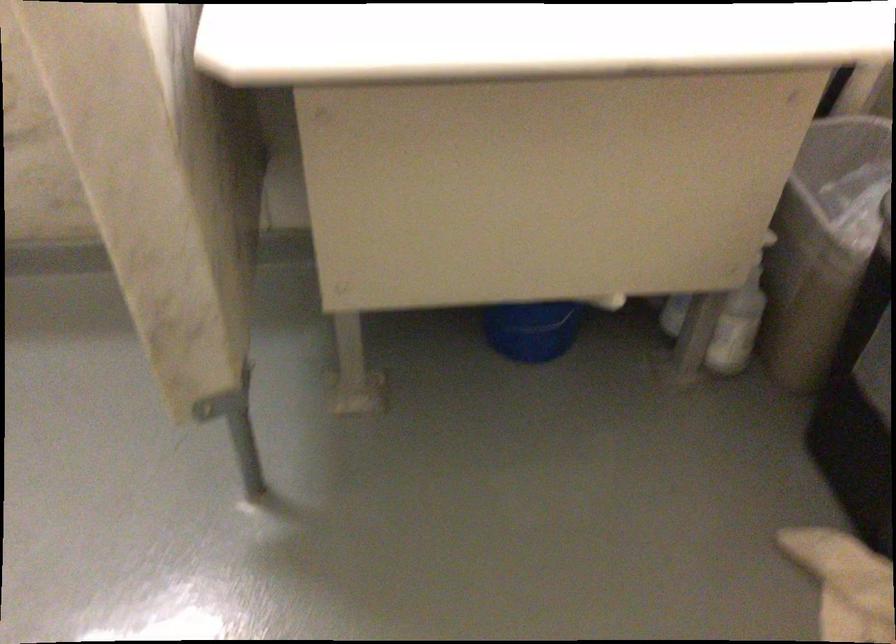
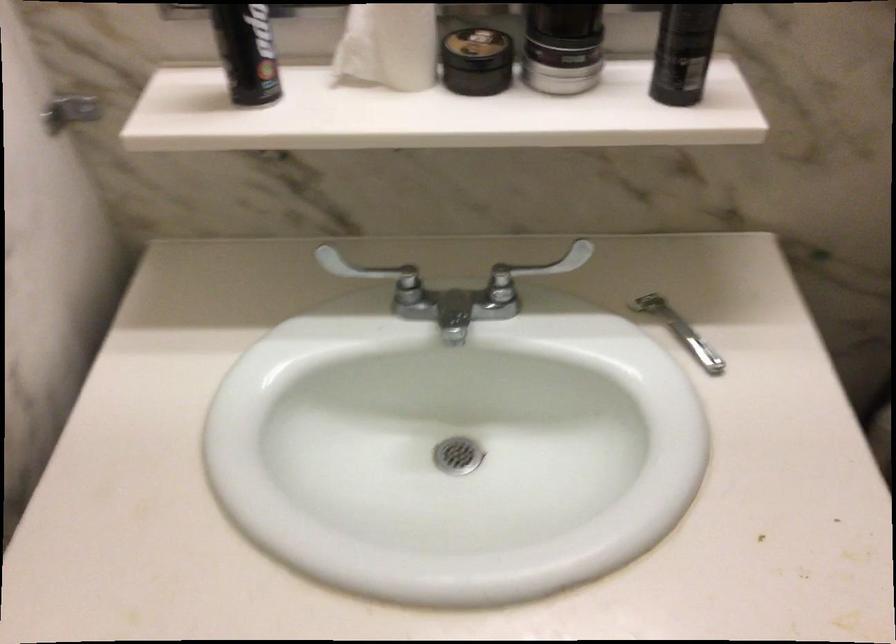
What movement of the cameraman would produce the second image?

The cameraman moved toward right, forward.